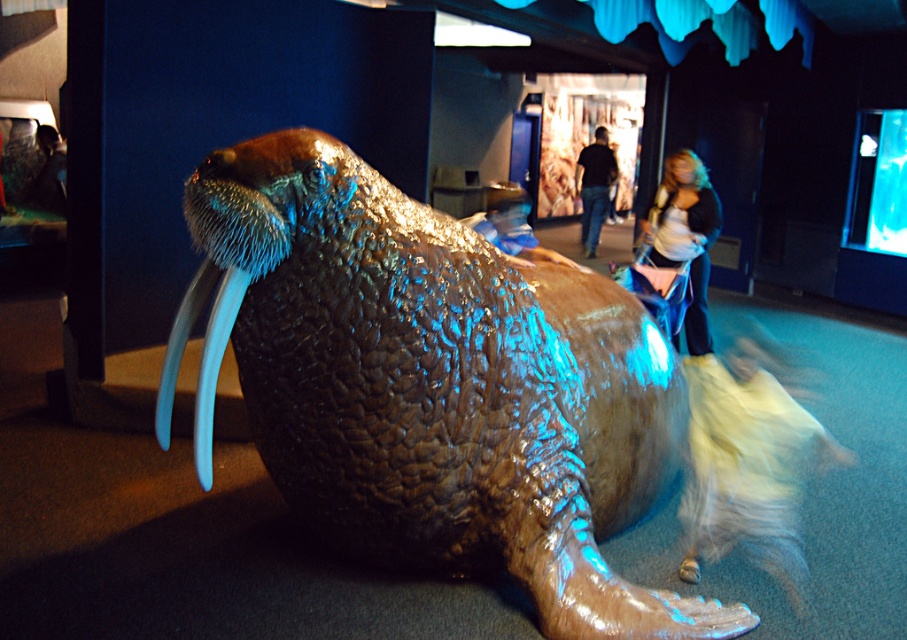
Question: Which object is the closest to the shiny brown walrus at center?

Choices:
 (A) dark blue jeans at center
 (B) blonde hair at upper right

Answer: (B)

Question: Which of the following is the farthest from the observer?

Choices:
 (A) white glossy tusk at lower left
 (B) blonde hair at upper right
 (C) shiny brown walrus at center

Answer: (B)

Question: Is blue plastic tusk at lower left wider than white glossy tusk at lower left?

Choices:
 (A) yes
 (B) no

Answer: (A)

Question: Is white glossy tusk at lower left bigger than dark blue jeans at center?

Choices:
 (A) no
 (B) yes

Answer: (A)

Question: Observing the image, what is the correct spatial positioning of shiny brown walrus at center in reference to blue plastic tusk at lower left?

Choices:
 (A) left
 (B) right

Answer: (B)

Question: Considering the real-world distances, which object is closest to the shiny brown walrus at center?

Choices:
 (A) blonde hair at upper right
 (B) dark blue jeans at center

Answer: (A)